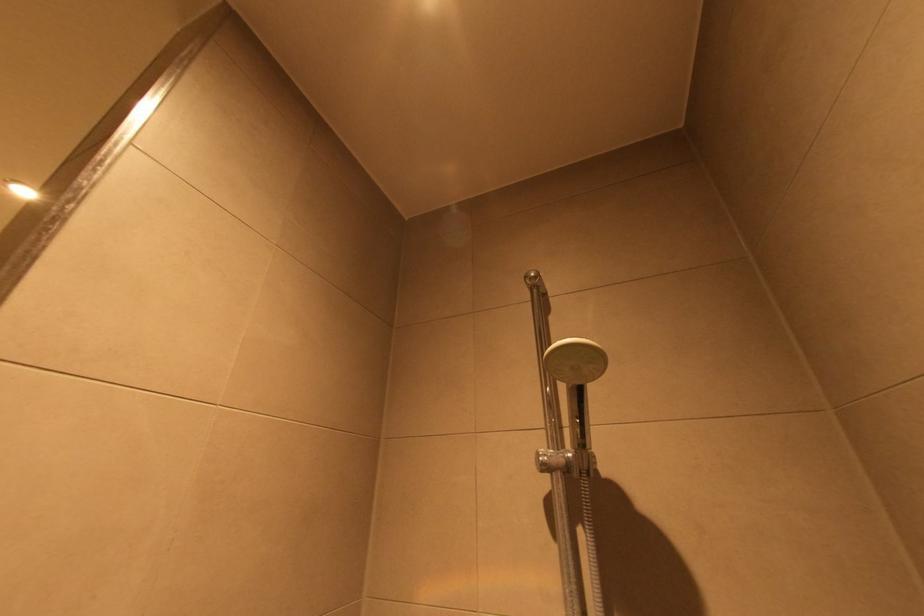
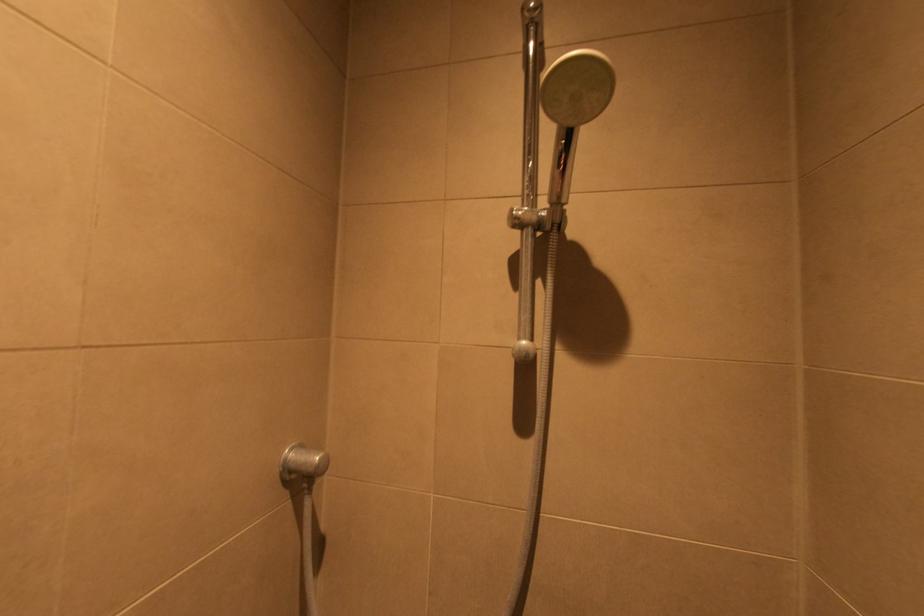
Question: What movement of the cameraman would produce the second image?

Choices:
 (A) Left
 (B) Right
 (C) Forward
 (D) Backward

Answer: (A)